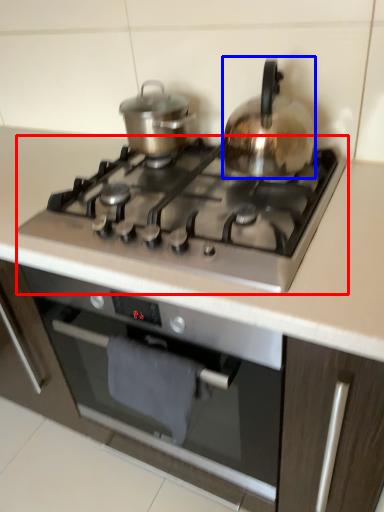
Question: Which object appears farthest to the camera in this image, gas stove (highlighted by a red box) or kitchen appliance (highlighted by a blue box)?

Choices:
 (A) gas stove
 (B) kitchen appliance

Answer: (B)